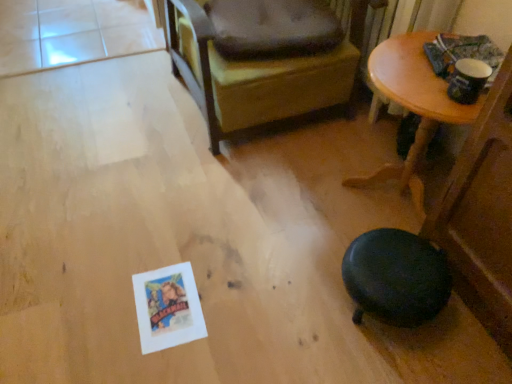
Question: Is dark brown leather chair at center smaller than dark brown fabric dog bed at upper center?

Choices:
 (A) yes
 (B) no

Answer: (B)

Question: Can you confirm if dark brown leather chair at center is taller than dark brown fabric dog bed at upper center?

Choices:
 (A) yes
 (B) no

Answer: (A)

Question: Is dark brown leather chair at center outside of dark brown fabric dog bed at upper center?

Choices:
 (A) yes
 (B) no

Answer: (A)

Question: Is dark brown leather chair at center at the left side of dark brown fabric dog bed at upper center?

Choices:
 (A) no
 (B) yes

Answer: (B)

Question: Is dark brown leather chair at center surrounding dark brown fabric dog bed at upper center?

Choices:
 (A) no
 (B) yes

Answer: (B)

Question: Considering their positions, is dark brown fabric dog bed at upper center located in front of or behind wooden table at upper right?

Choices:
 (A) front
 (B) behind

Answer: (B)

Question: Which is correct: dark brown fabric dog bed at upper center is inside wooden table at upper right, or outside of it?

Choices:
 (A) inside
 (B) outside

Answer: (B)

Question: Looking at their shapes, would you say dark brown fabric dog bed at upper center is wider or thinner than wooden table at upper right?

Choices:
 (A) thin
 (B) wide

Answer: (A)

Question: From their relative heights in the image, would you say dark brown fabric dog bed at upper center is taller or shorter than wooden table at upper right?

Choices:
 (A) short
 (B) tall

Answer: (A)

Question: Is wooden table at upper right wider or thinner than dark brown leather chair at center?

Choices:
 (A) thin
 (B) wide

Answer: (A)

Question: From the image's perspective, is wooden table at upper right located above or below dark brown leather chair at center?

Choices:
 (A) above
 (B) below

Answer: (B)

Question: From a real-world perspective, relative to dark brown leather chair at center, is wooden table at upper right vertically above or below?

Choices:
 (A) above
 (B) below

Answer: (B)

Question: In the image, is wooden table at upper right positioned in front of or behind dark brown leather chair at center?

Choices:
 (A) front
 (B) behind

Answer: (A)

Question: From the image's perspective, is dark brown fabric dog bed at upper center positioned above or below dark brown leather chair at center?

Choices:
 (A) above
 (B) below

Answer: (B)

Question: From a real-world perspective, is dark brown fabric dog bed at upper center physically located above or below dark brown leather chair at center?

Choices:
 (A) above
 (B) below

Answer: (A)